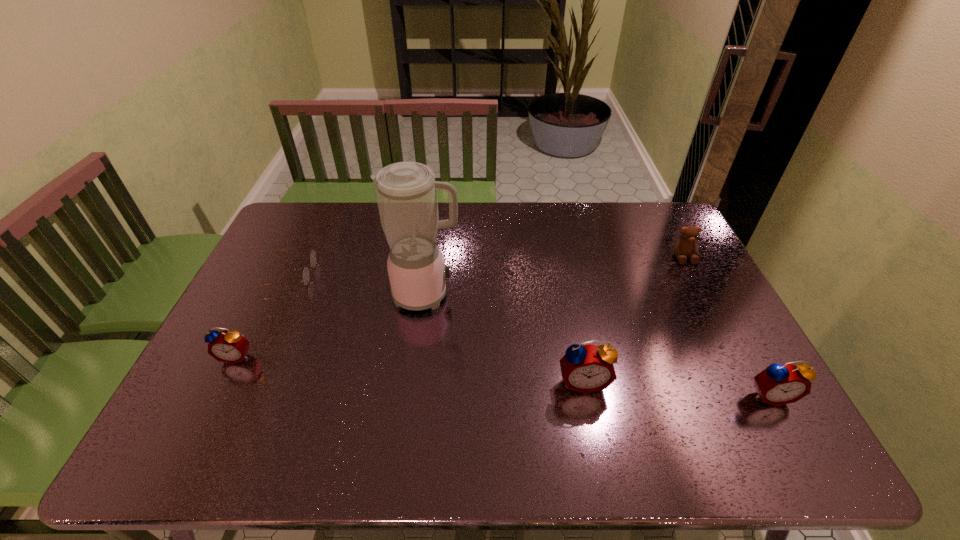
The width and height of the screenshot is (960, 540). What are the coordinates of `blank space at the near edge of the desktop` in the screenshot? It's located at (575, 409).

In order to click on vacant region at the left edge of the desktop in this screenshot , I will do `click(295, 258)`.

At what (x,y) coordinates should I click in order to perform the action: click on free location at the right edge of the desktop. Please return your answer as a coordinate pair (x, y). Looking at the image, I should click on (704, 265).

You are a GUI agent. You are given a task and a screenshot of the screen. Output one action in this format:
    pyautogui.click(x=<x>, y=<y>)
    Task: Click on the vacant space at the far left corner
    The height and width of the screenshot is (540, 960).
    Given the screenshot: What is the action you would take?
    pyautogui.click(x=316, y=238)

Find the location of a particular element. vacant space at the far right corner of the desktop is located at coordinates (628, 204).

Image resolution: width=960 pixels, height=540 pixels. What are the coordinates of `empty space between the rightmost alarm clock and the shortest object` in the screenshot? It's located at (531, 335).

Locate an element on the screen. The height and width of the screenshot is (540, 960). free space between the leftmost alarm clock and the third object from left to right is located at coordinates (331, 326).

Locate an element on the screen. Image resolution: width=960 pixels, height=540 pixels. empty location between the teddy bear and the food processor is located at coordinates (555, 276).

The width and height of the screenshot is (960, 540). I want to click on vacant point located between the second alarm clock from right to left and the spectacles, so (438, 328).

I want to click on free space between the farthest alarm clock and the teddy bear, so click(460, 307).